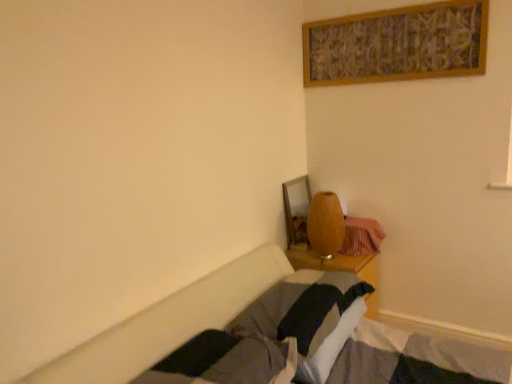
Question: Would you say soft gray pillow at center is inside or outside matte yellow lamp at center?

Choices:
 (A) inside
 (B) outside

Answer: (B)

Question: In terms of height, does soft gray pillow at center look taller or shorter compared to matte yellow lamp at center?

Choices:
 (A) tall
 (B) short

Answer: (B)

Question: Estimate the real-world distances between objects in this image. Which object is closer to the soft gray pillow at center?

Choices:
 (A) matte yellow lamp at center
 (B) plaid fabric blanket at lower right

Answer: (A)

Question: Which of these objects is positioned farthest from the matte yellow lamp at center?

Choices:
 (A) soft gray pillow at center
 (B) plaid fabric blanket at lower right

Answer: (A)